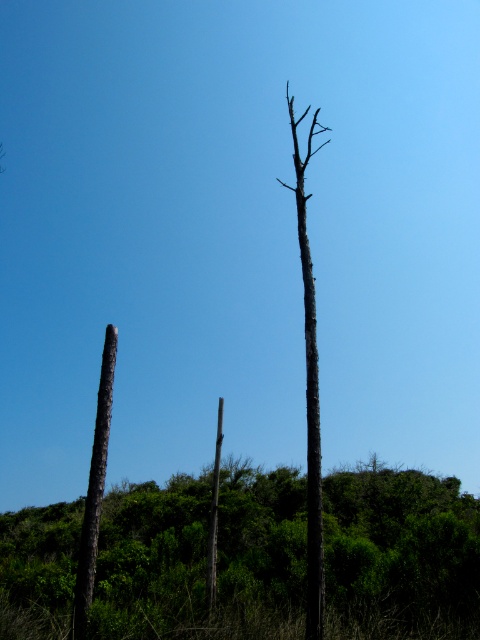
Is point (109, 380) farther from viewer compared to point (208, 608)?

No.

Who is taller, charcoal rough log at left or smooth gray pole at center?

smooth gray pole at center

Where is `charcoal rough log at left`? charcoal rough log at left is located at coordinates (95, 488).

Who is positioned more to the left, smooth gray tree trunk at center or smooth gray pole at center?

Positioned to the left is smooth gray pole at center.

Does point (300, 257) come farther from viewer compared to point (208, 605)?

Yes, it is behind point (208, 605).

Where is `smooth gray tree trunk at center`? The height and width of the screenshot is (640, 480). smooth gray tree trunk at center is located at coordinates (310, 385).

What do you see at coordinates (203, 557) in the screenshot? I see `brown rough tree trunk at left` at bounding box center [203, 557].

Find the location of `brown rough tree trunk at left`. brown rough tree trunk at left is located at coordinates (203, 557).